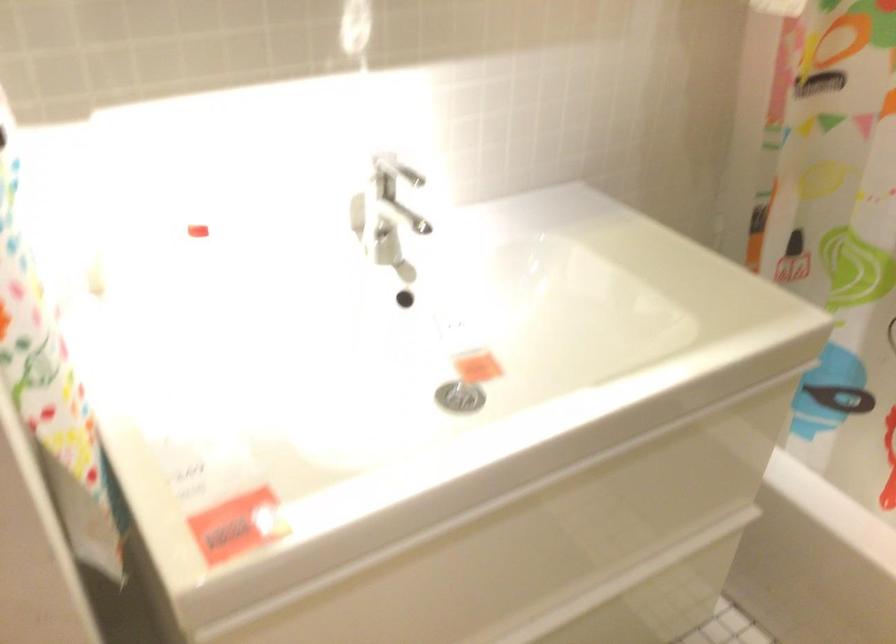
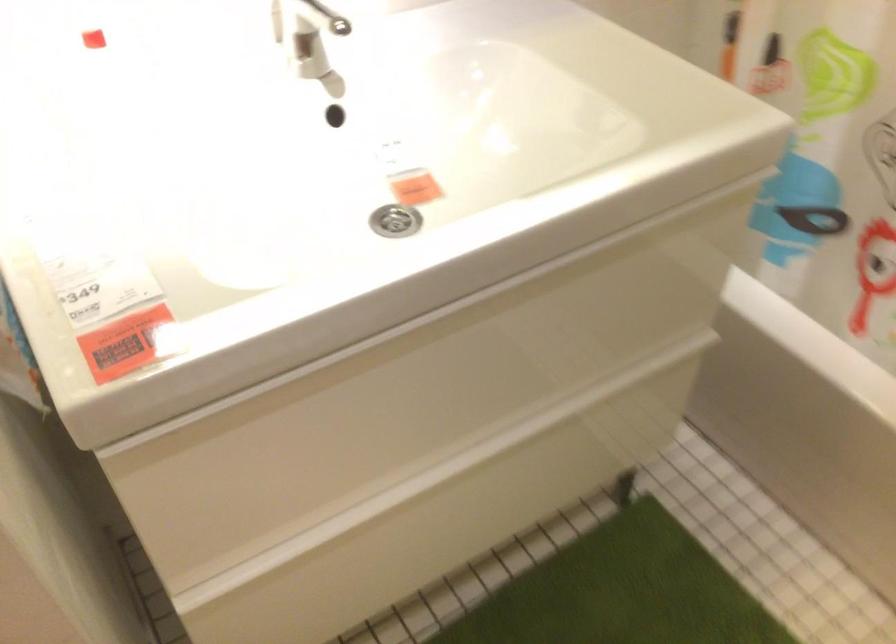
In the second image, find the point that corresponds to (x=194, y=230) in the first image.

(92, 39)